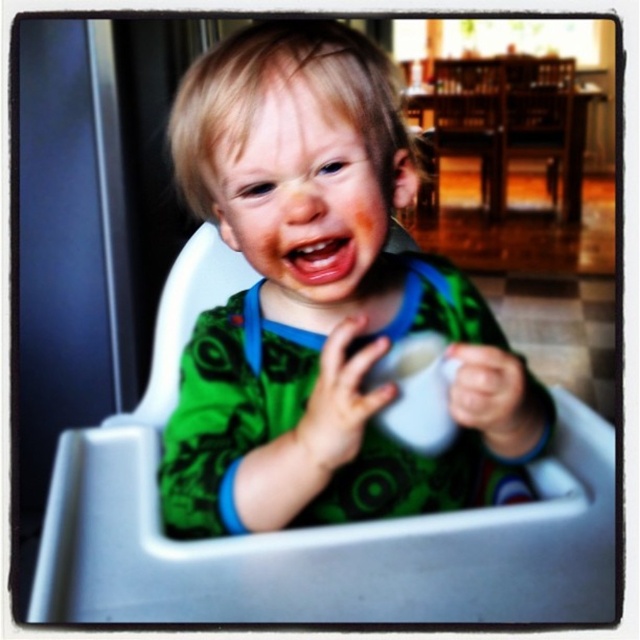
Question: Which object is farther from the camera taking this photo?

Choices:
 (A) white plastic feeding chair at center
 (B) green matte shirt at center

Answer: (B)

Question: Is green matte shirt at center closer to the viewer compared to white plastic feeding chair at center?

Choices:
 (A) yes
 (B) no

Answer: (B)

Question: Is the position of green matte shirt at center less distant than that of white plastic feeding chair at center?

Choices:
 (A) no
 (B) yes

Answer: (A)

Question: Is green matte shirt at center below white plastic feeding chair at center?

Choices:
 (A) no
 (B) yes

Answer: (A)